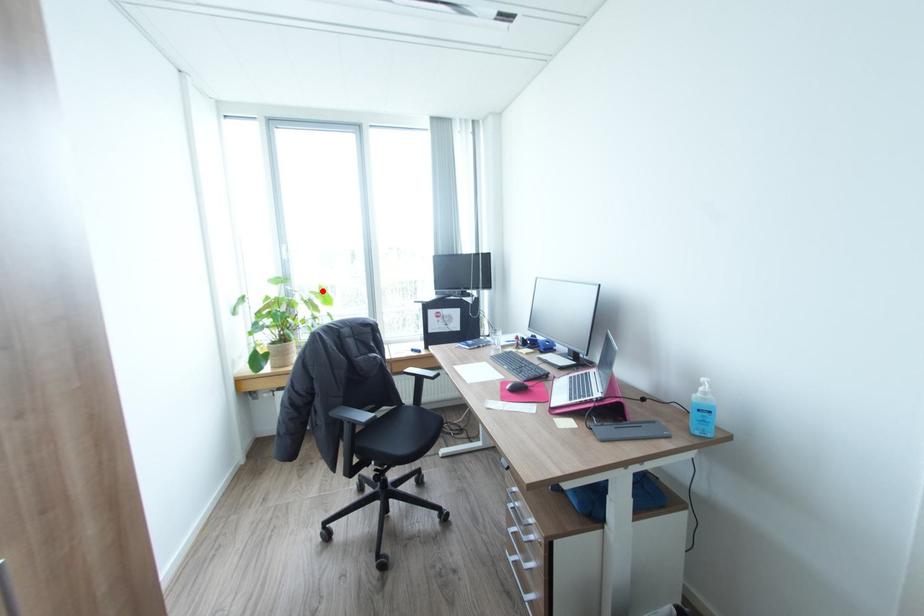
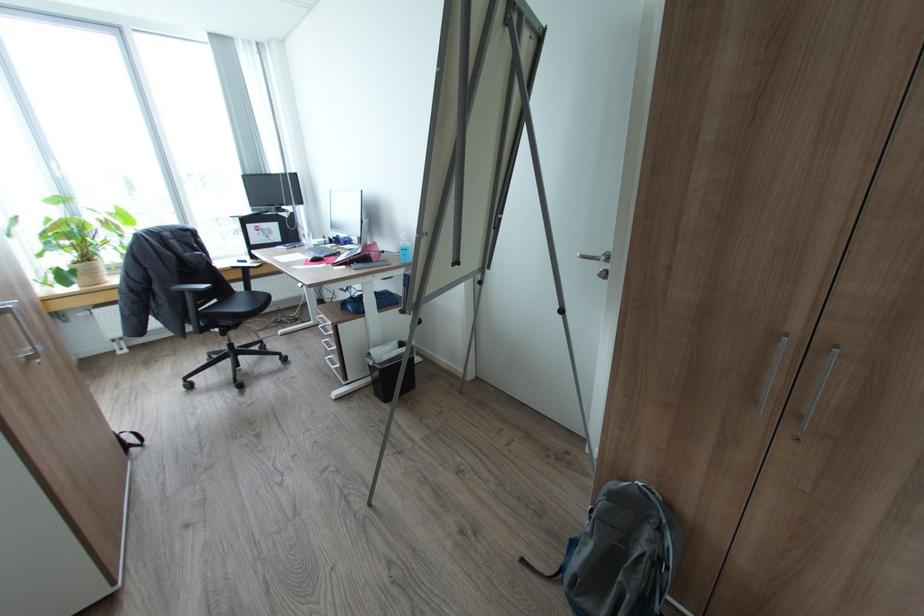
The point at the highlighted location is marked in the first image. Where is the corresponding point in the second image?

(119, 211)